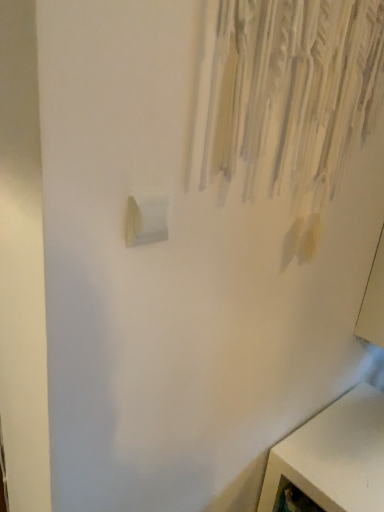
Measure the distance between point (150,234) and camera.

They are 26.30 inches apart.

The height and width of the screenshot is (512, 384). Identify the location of white plastic light switch at lower left. pyautogui.click(x=147, y=218).

This screenshot has height=512, width=384. What do you see at coordinates (147, 218) in the screenshot?
I see `white plastic light switch at lower left` at bounding box center [147, 218].

Describe the element at coordinates (334, 456) in the screenshot. The height and width of the screenshot is (512, 384). I see `white matte cabinet at lower right` at that location.

At what (x,y) coordinates should I click in order to perform the action: click on white matte cabinet at lower right. Please return your answer as a coordinate pair (x, y). Looking at the image, I should click on (334, 456).

The height and width of the screenshot is (512, 384). What are the coordinates of `white plastic light switch at lower left` in the screenshot? It's located at (147, 218).

Considering the relative positions of white plastic light switch at lower left and white matte cabinet at lower right in the image provided, is white plastic light switch at lower left to the left of white matte cabinet at lower right from the viewer's perspective?

Yes, white plastic light switch at lower left is to the left of white matte cabinet at lower right.

Considering the positions of objects white plastic light switch at lower left and white matte cabinet at lower right in the image provided, who is in front, white plastic light switch at lower left or white matte cabinet at lower right?

white plastic light switch at lower left is in front.

Does point (126, 219) lie behind point (331, 405)?

No.

From the image's perspective, which one is positioned lower, white plastic light switch at lower left or white matte cabinet at lower right?

white matte cabinet at lower right, from the image's perspective.

From a real-world perspective, relative to white matte cabinet at lower right, is white plastic light switch at lower left vertically above or below?

From a real-world perspective, white plastic light switch at lower left is physically above white matte cabinet at lower right.

Considering the sizes of objects white plastic light switch at lower left and white matte cabinet at lower right in the image provided, who is wider, white plastic light switch at lower left or white matte cabinet at lower right?

With larger width is white matte cabinet at lower right.

From the picture: Between white plastic light switch at lower left and white matte cabinet at lower right, which one has less height?

white plastic light switch at lower left is shorter.

Does white plastic light switch at lower left have a larger size compared to white matte cabinet at lower right?

Actually, white plastic light switch at lower left might be smaller than white matte cabinet at lower right.

Is white matte cabinet at lower right a part of white plastic light switch at lower left?

No, white matte cabinet at lower right is located outside of white plastic light switch at lower left.

Is white plastic light switch at lower left placed right next to white matte cabinet at lower right?

No, white plastic light switch at lower left is not in contact with white matte cabinet at lower right.

Is white plastic light switch at lower left facing away from white matte cabinet at lower right?

No, white plastic light switch at lower left's orientation is not away from white matte cabinet at lower right.

Measure the distance from white plastic light switch at lower left to white matte cabinet at lower right.

98.00 centimeters.

Image resolution: width=384 pixels, height=512 pixels. Identify the location of light switch above the white matte cabinet at lower right (from a real-world perspective). (147, 218).

Is white matte cabinet at lower right at the right side of white plastic light switch at lower left?

Yes.

Which object is closer to the camera, white matte cabinet at lower right or white plastic light switch at lower left?

white plastic light switch at lower left.

Is point (280, 466) positioned before point (156, 234)?

No, (280, 466) is behind (156, 234).

From the image's perspective, does white matte cabinet at lower right appear lower than white plastic light switch at lower left?

Yes.

From a real-world perspective, is white matte cabinet at lower right below white plastic light switch at lower left?

Yes.

Based on the photo, does white matte cabinet at lower right have a lesser width compared to white plastic light switch at lower left?

No, white matte cabinet at lower right is not thinner than white plastic light switch at lower left.

Based on the photo, is white matte cabinet at lower right taller than white plastic light switch at lower left?

Correct, white matte cabinet at lower right is much taller as white plastic light switch at lower left.

Does white matte cabinet at lower right have a smaller size compared to white plastic light switch at lower left?

No, white matte cabinet at lower right is not smaller than white plastic light switch at lower left.

Could white plastic light switch at lower left be considered to be inside white matte cabinet at lower right?

No, white plastic light switch at lower left is not surrounded by white matte cabinet at lower right.

Does white matte cabinet at lower right touch white plastic light switch at lower left?

white matte cabinet at lower right is not next to white plastic light switch at lower left, and they're not touching.

Consider the image. Could you tell me if white matte cabinet at lower right is turned towards white plastic light switch at lower left?

No.

How much distance is there between white matte cabinet at lower right and white plastic light switch at lower left?

They are 38.58 inches apart.

Locate an element on the screen. light switch that is in front of the white matte cabinet at lower right is located at coordinates (147, 218).

The height and width of the screenshot is (512, 384). In order to click on light switch in front of the white matte cabinet at lower right in this screenshot , I will do `click(147, 218)`.

The width and height of the screenshot is (384, 512). In order to click on light switch above the white matte cabinet at lower right (from a real-world perspective) in this screenshot , I will do `click(147, 218)`.